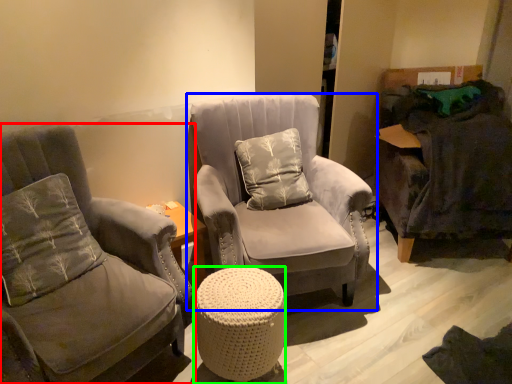
Question: Which object is positioned closest to chair (highlighted by a red box)? Select from chair (highlighted by a blue box) and table (highlighted by a green box).

Choices:
 (A) chair
 (B) table

Answer: (B)